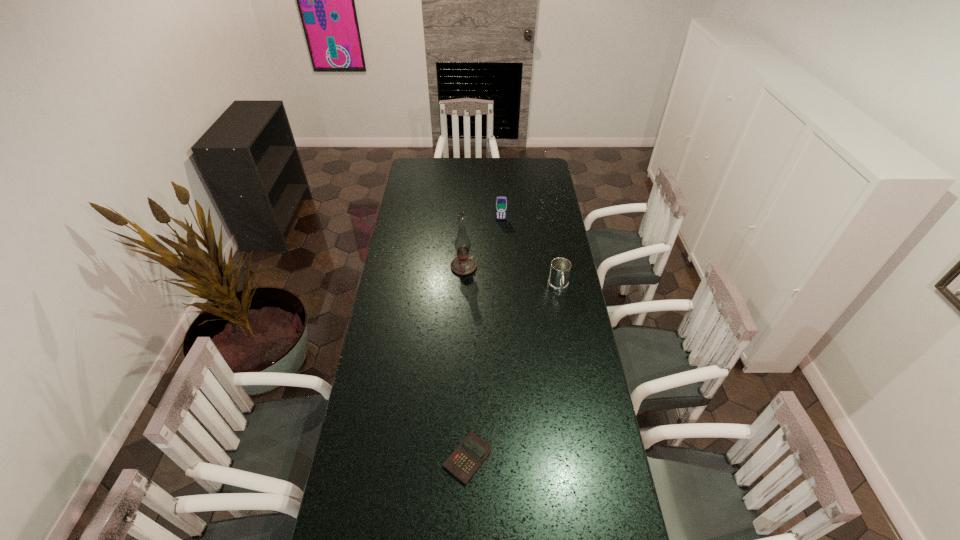
The height and width of the screenshot is (540, 960). What are the coordinates of `free space between the rightmost object and the oil lamp` in the screenshot? It's located at (511, 278).

The height and width of the screenshot is (540, 960). What are the coordinates of `vacant point located between the third object from left to right and the third farthest object` in the screenshot? It's located at (530, 254).

The height and width of the screenshot is (540, 960). I want to click on unoccupied position between the second farthest object and the third object from left to right, so click(x=482, y=244).

The image size is (960, 540). What are the coordinates of `vacant area that lies between the third nearest object and the cellular telephone` in the screenshot? It's located at (482, 244).

You are a GUI agent. You are given a task and a screenshot of the screen. Output one action in this format:
    pyautogui.click(x=<x>, y=<y>)
    Task: Click on the free spot between the nearest object and the oil lamp
    This screenshot has width=960, height=540.
    Given the screenshot: What is the action you would take?
    pyautogui.click(x=466, y=362)

Image resolution: width=960 pixels, height=540 pixels. In order to click on unoccupied position between the calculator and the farthest object in this screenshot , I will do `click(484, 339)`.

I want to click on object that stands as the third closest to the third farthest object, so click(x=470, y=454).

You are a GUI agent. You are given a task and a screenshot of the screen. Output one action in this format:
    pyautogui.click(x=<x>, y=<y>)
    Task: Click on the object that stands as the closest to the third nearest object
    Image resolution: width=960 pixels, height=540 pixels.
    Given the screenshot: What is the action you would take?
    pyautogui.click(x=501, y=202)